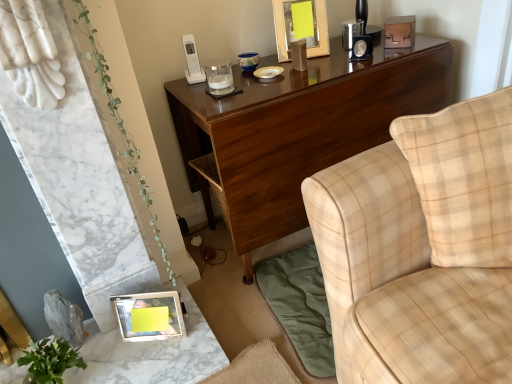
Find the location of a particular element. This screenshot has height=384, width=512. free space above metallic silver frame at lower left (from a real-world perspective) is located at coordinates (129, 353).